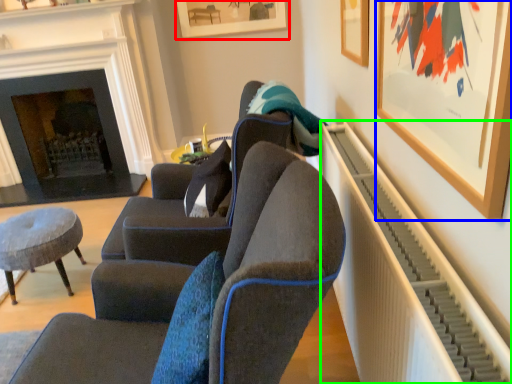
Question: Estimate the real-world distances between objects in this image. Which object is closer to picture frame (highlighted by a red box), picture frame (highlighted by a blue box) or radiator (highlighted by a green box)?

Choices:
 (A) picture frame
 (B) radiator

Answer: (B)